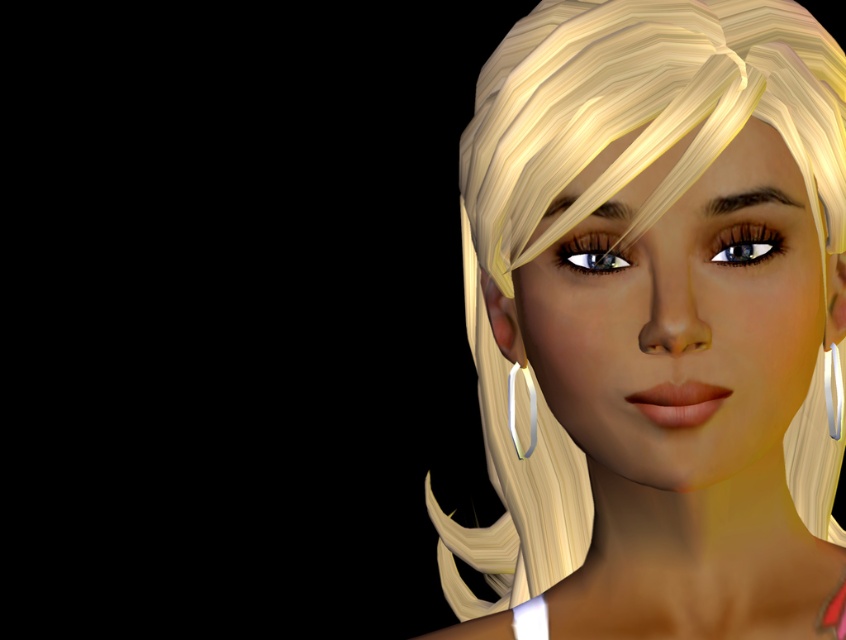
Question: Is shiny blonde hair at center below shiny blue eye at center?

Choices:
 (A) yes
 (B) no

Answer: (A)

Question: Estimate the real-world distances between objects in this image. Which object is closer to the shiny blue eye at center?

Choices:
 (A) shiny brown eye at center
 (B) shiny silver earring at left
 (C) shiny gold hair at center

Answer: (A)

Question: Which point appears closest to the camera in this image?

Choices:
 (A) (606, 256)
 (B) (842, 396)
 (C) (525, 380)
 (D) (739, 262)

Answer: (D)

Question: Does shiny gold hair at center have a greater width compared to shiny silver earring at left?

Choices:
 (A) yes
 (B) no

Answer: (A)

Question: Is shiny blue eye at center wider than silver metallic earring at right?

Choices:
 (A) yes
 (B) no

Answer: (B)

Question: Which object is the farthest from the shiny gold hair at center?

Choices:
 (A) silver metallic earring at right
 (B) shiny brown eye at center

Answer: (A)